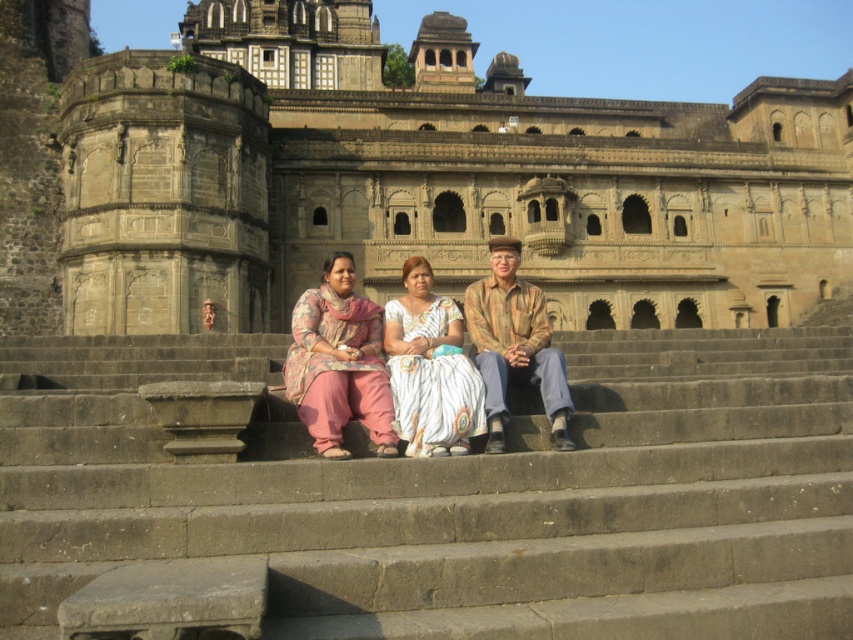
You are standing on the brown stone stairs at center and want to move to the matte pink pants at center. Which direction should you move?

The brown stone stairs at center is to the right of the matte pink pants at center, so you should move to the left to reach the matte pink pants at center.

You are standing on the brown stone stairs at center and want to place a small statue on the matte pink pants at center. Can the statue be placed directly on the pants without any support?

The brown stone stairs at center is not as tall as matte pink pants at center, so the statue can be placed directly on the matte pink pants at center without needing additional support.